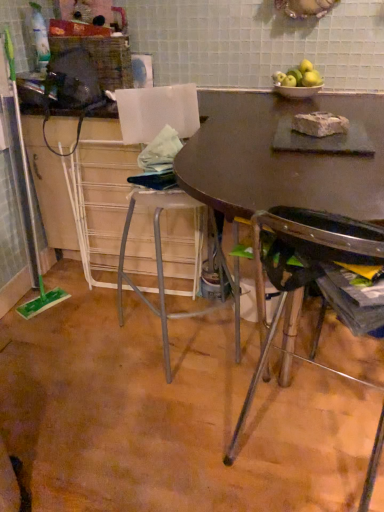
Question: Considering the relative sizes of matte brown table at upper center and metallic silver chair at lower right in the image provided, is matte brown table at upper center bigger than metallic silver chair at lower right?

Choices:
 (A) yes
 (B) no

Answer: (A)

Question: Is matte brown table at upper center far from metallic silver chair at lower right?

Choices:
 (A) yes
 (B) no

Answer: (B)

Question: Can you confirm if matte brown table at upper center is shorter than metallic silver chair at lower right?

Choices:
 (A) no
 (B) yes

Answer: (B)

Question: Is metallic silver chair at lower right located within matte brown table at upper center?

Choices:
 (A) yes
 (B) no

Answer: (B)

Question: Considering the relative sizes of matte brown table at upper center and metallic silver chair at lower right in the image provided, is matte brown table at upper center taller than metallic silver chair at lower right?

Choices:
 (A) no
 (B) yes

Answer: (A)

Question: Based on their positions, is matte brown table at center located to the left or right of metallic silver chair at lower right?

Choices:
 (A) right
 (B) left

Answer: (B)

Question: From the image's perspective, relative to metallic silver chair at lower right, is matte brown table at center above or below?

Choices:
 (A) below
 (B) above

Answer: (B)

Question: Which is correct: matte brown table at center is inside metallic silver chair at lower right, or outside of it?

Choices:
 (A) outside
 (B) inside

Answer: (A)

Question: Based on their sizes in the image, would you say matte brown table at center is bigger or smaller than metallic silver chair at lower right?

Choices:
 (A) small
 (B) big

Answer: (B)

Question: Would you say matte brown table at upper center is to the left or to the right of matte brown table at center in the picture?

Choices:
 (A) left
 (B) right

Answer: (A)

Question: In terms of height, does matte brown table at upper center look taller or shorter compared to matte brown table at center?

Choices:
 (A) short
 (B) tall

Answer: (B)

Question: From a real-world perspective, is matte brown table at upper center positioned above or below matte brown table at center?

Choices:
 (A) above
 (B) below

Answer: (B)

Question: Is matte brown table at upper center wider or thinner than matte brown table at center?

Choices:
 (A) wide
 (B) thin

Answer: (B)

Question: Relative to matte brown table at upper center, is matte brown table at center in front or behind?

Choices:
 (A) front
 (B) behind

Answer: (A)

Question: Looking at their shapes, would you say matte brown table at center is wider or thinner than matte brown table at upper center?

Choices:
 (A) wide
 (B) thin

Answer: (A)